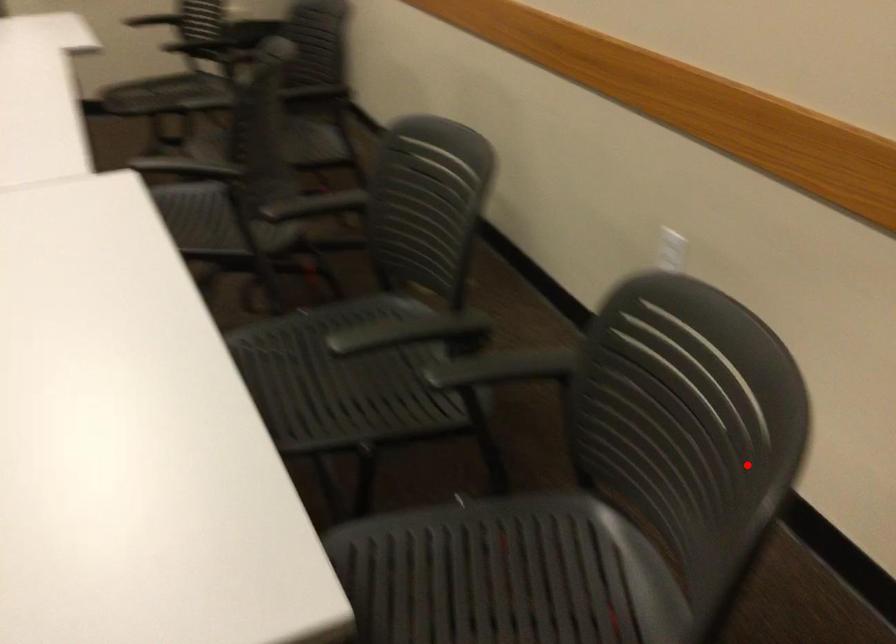
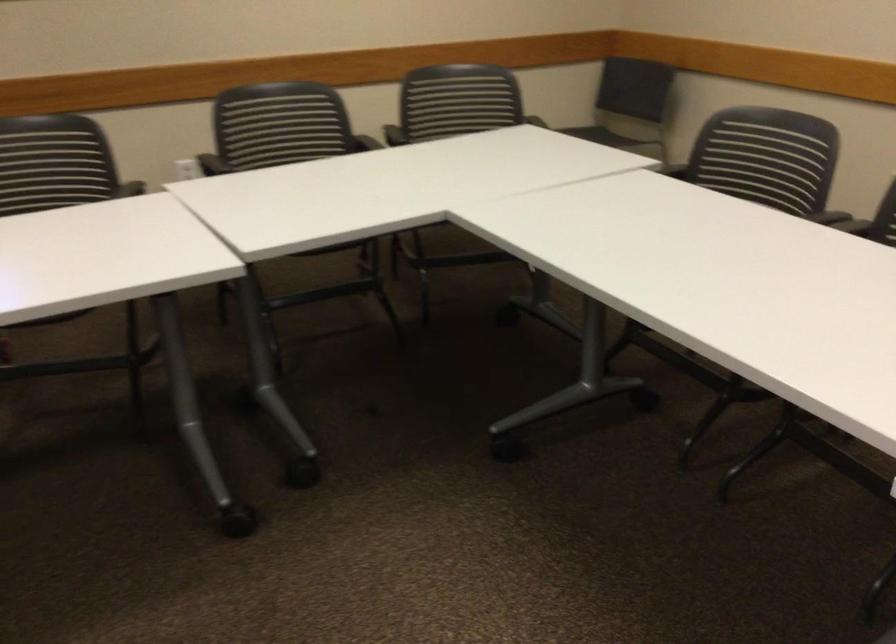
Question: A red point is marked in image1. In image2, is the corresponding 3D point closer to the camera or farther? Reply with the corresponding letter.

Choices:
 (A) The corresponding 3D point is closer.
 (B) The corresponding 3D point is farther.

Answer: (B)